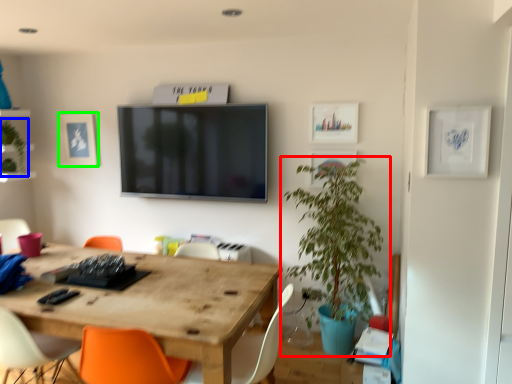
Question: Based on their relative distances, which object is farther from houseplant (highlighted by a red box)? Choose from plant (highlighted by a blue box) and picture frame (highlighted by a green box).

Choices:
 (A) plant
 (B) picture frame

Answer: (A)